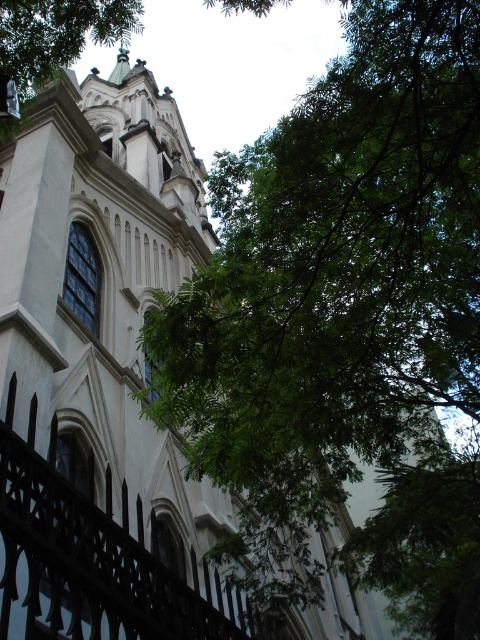
Can you confirm if green leafy tree at upper right is positioned to the left of green leafy tree at upper center?

No, green leafy tree at upper right is not to the left of green leafy tree at upper center.

Who is lower down, green leafy tree at upper right or green leafy tree at upper center?

green leafy tree at upper right is lower down.

Find the location of a particular element. green leafy tree at upper right is located at coordinates (346, 321).

Consider the image. Does green leafy tree at upper right come in front of black wrought iron fence at lower left?

No, green leafy tree at upper right is behind black wrought iron fence at lower left.

Can you confirm if green leafy tree at upper right is shorter than black wrought iron fence at lower left?

Incorrect, green leafy tree at upper right's height does not fall short of black wrought iron fence at lower left's.

This screenshot has height=640, width=480. Find the location of `green leafy tree at upper right`. green leafy tree at upper right is located at coordinates (346, 321).

Locate an element on the screen. green leafy tree at upper right is located at coordinates (346, 321).

Between black wrought iron fence at lower left and green leafy tree at upper center, which one is positioned higher?

green leafy tree at upper center

Between point (26, 636) and point (134, 1), which one is positioned in front?

Point (26, 636) is more forward.

You are a GUI agent. You are given a task and a screenshot of the screen. Output one action in this format:
    pyautogui.click(x=<x>, y=<y>)
    Task: Click on the black wrought iron fence at lower left
    Image resolution: width=480 pixels, height=640 pixels.
    Given the screenshot: What is the action you would take?
    pyautogui.click(x=96, y=564)